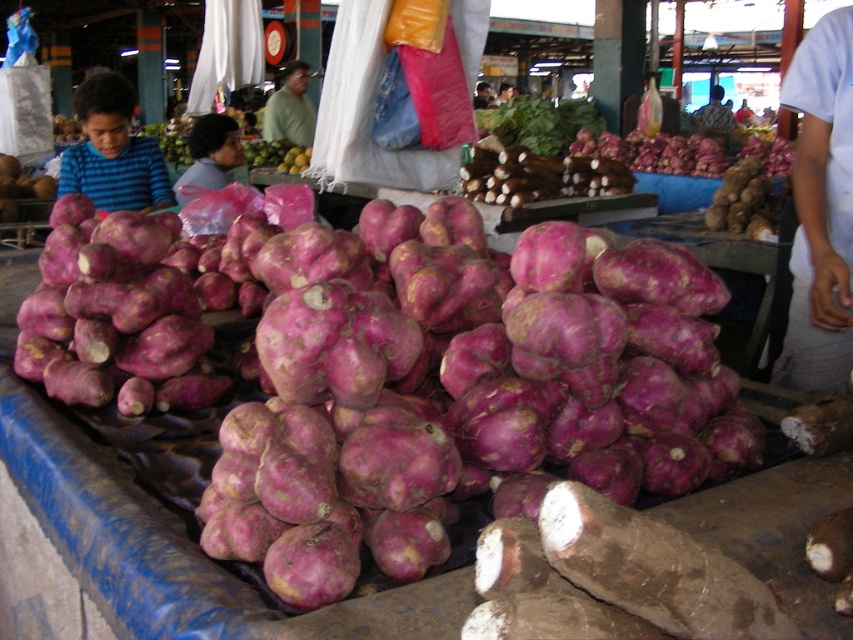
Question: Which of these objects is positioned closest to the purple matte onion at upper center?

Choices:
 (A) green matte shirt at center
 (B) striped shirt at center
 (C) green matte mango at center
 (D) brown rough root at center

Answer: (D)

Question: Is blue striped shirt at left smaller than green matte mango at center?

Choices:
 (A) yes
 (B) no

Answer: (A)

Question: Which point is closer to the camera taking this photo?

Choices:
 (A) (728, 129)
 (B) (642, 148)
 (C) (268, 109)

Answer: (B)

Question: Among these points, which one is nearest to the camera?

Choices:
 (A) (256, 154)
 (B) (500, 124)
 (C) (305, 122)
 (D) (103, 90)

Answer: (D)

Question: Is purple matte root at center to the left of green matte shirt at center from the viewer's perspective?

Choices:
 (A) yes
 (B) no

Answer: (B)

Question: In this image, where is brown rough root at center located relative to purple matte root at center?

Choices:
 (A) right
 (B) left

Answer: (B)